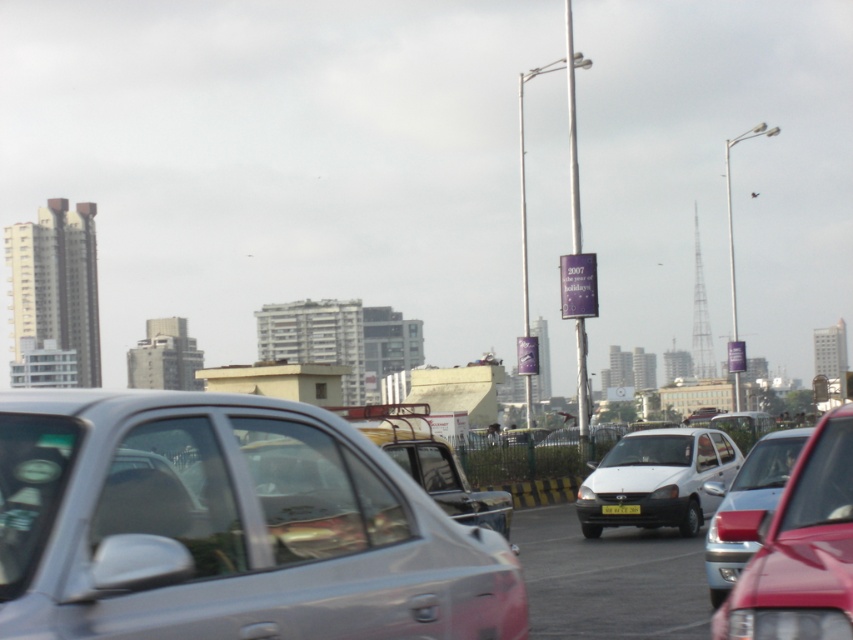
Question: Among these points, which one is nearest to the camera?

Choices:
 (A) (834, 536)
 (B) (364, 444)

Answer: (A)

Question: Is metallic silver sedan at center positioned before white matte sedan at center?

Choices:
 (A) no
 (B) yes

Answer: (B)

Question: Estimate the real-world distances between objects in this image. Which object is closer to the metallic silver sedan at center?

Choices:
 (A) silver metallic car at center
 (B) yellow matte license plate at center
 (C) white matte sedan at center

Answer: (A)

Question: Can you confirm if silver metallic car at center is positioned to the right of metallic silver sedan at center?

Choices:
 (A) yes
 (B) no

Answer: (B)

Question: Where is silver metallic car at center located in relation to metallic silver sedan at center in the image?

Choices:
 (A) right
 (B) left

Answer: (B)

Question: Estimate the real-world distances between objects in this image. Which object is farther from the metallic silver sedan at center?

Choices:
 (A) white matte sedan at center
 (B) silver metallic car at center

Answer: (A)